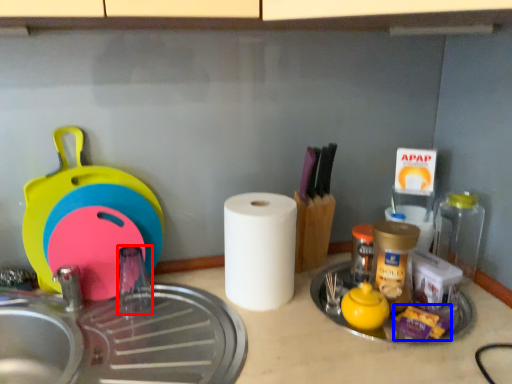
Question: Which of the following is the farthest to the observer, faucet (highlighted by a red box) or food (highlighted by a blue box)?

Choices:
 (A) faucet
 (B) food

Answer: (A)